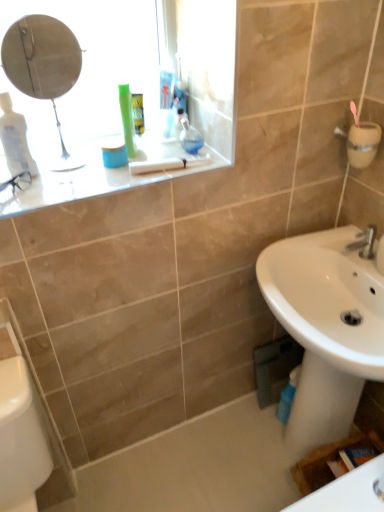
The image size is (384, 512). I want to click on vacant area on top of white glossy bath at lower center (from a real-world perspective), so click(x=215, y=463).